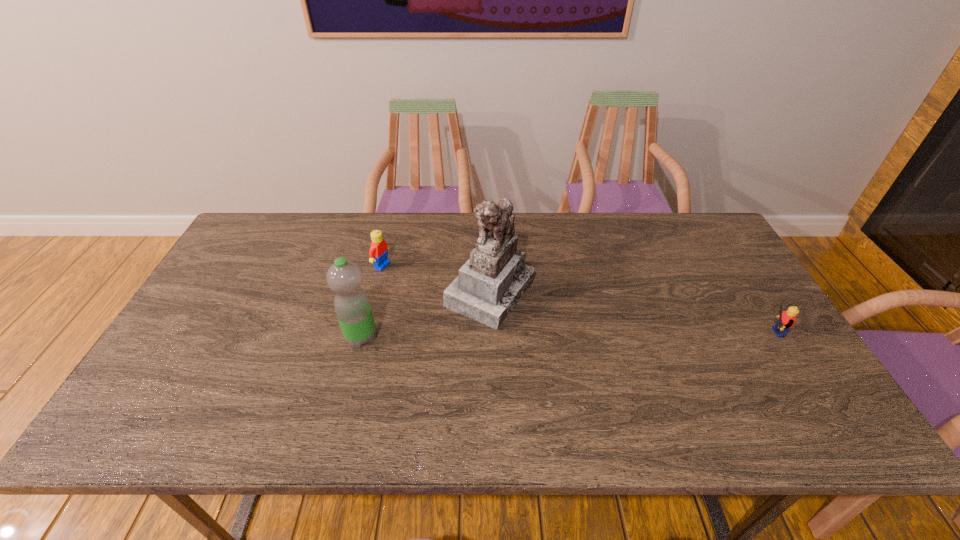
In the image, there is a desktop. Identify the location of vacant region at the near edge. (528, 390).

Find the location of a particular element. free region at the left edge of the desktop is located at coordinates (197, 304).

This screenshot has width=960, height=540. I want to click on free space at the right edge of the desktop, so click(704, 262).

The width and height of the screenshot is (960, 540). What are the coordinates of `free space at the far left corner` in the screenshot? It's located at (266, 251).

Where is `free space at the near right corner of the desktop`? free space at the near right corner of the desktop is located at coordinates (805, 370).

This screenshot has width=960, height=540. Identify the location of free point between the right Lego and the third shortest object. (565, 335).

Where is `vacant area that lies between the third object from left to right and the water bottle`? The width and height of the screenshot is (960, 540). vacant area that lies between the third object from left to right and the water bottle is located at coordinates (425, 314).

I want to click on empty space between the nearer Lego and the third shortest object, so click(565, 335).

The height and width of the screenshot is (540, 960). What are the coordinates of `free space that is in between the water bottle and the farther Lego` in the screenshot? It's located at (372, 301).

Find the location of `vacant space that is in between the left Lego and the water bottle`. vacant space that is in between the left Lego and the water bottle is located at coordinates (372, 301).